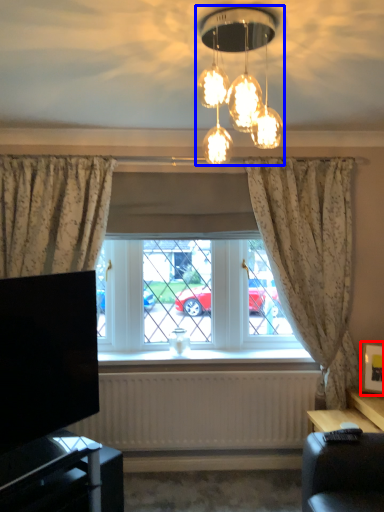
Question: Which object is further to the camera taking this photo, picture frame (highlighted by a red box) or lamp (highlighted by a blue box)?

Choices:
 (A) picture frame
 (B) lamp

Answer: (A)